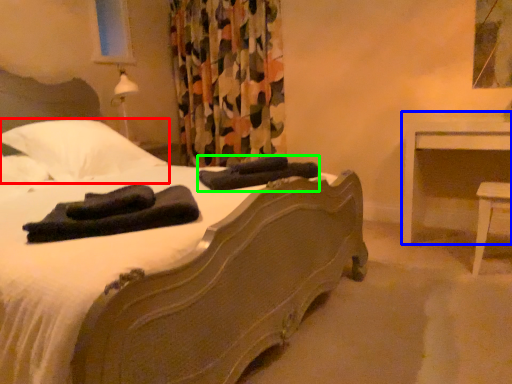
Question: Estimate the real-world distances between objects in this image. Which object is closer to pillow (highlighted by a red box), nightstand (highlighted by a blue box) or material (highlighted by a green box)?

Choices:
 (A) nightstand
 (B) material

Answer: (B)